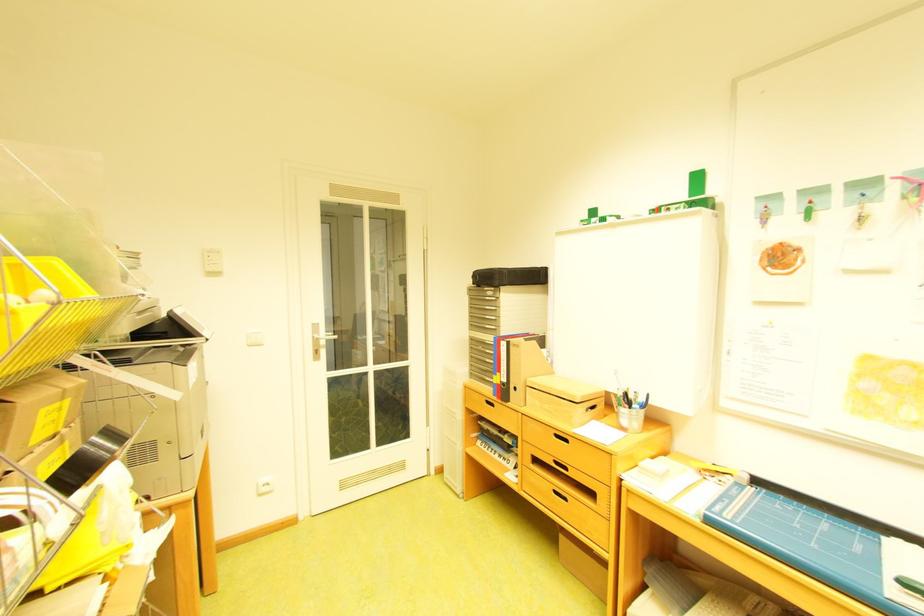
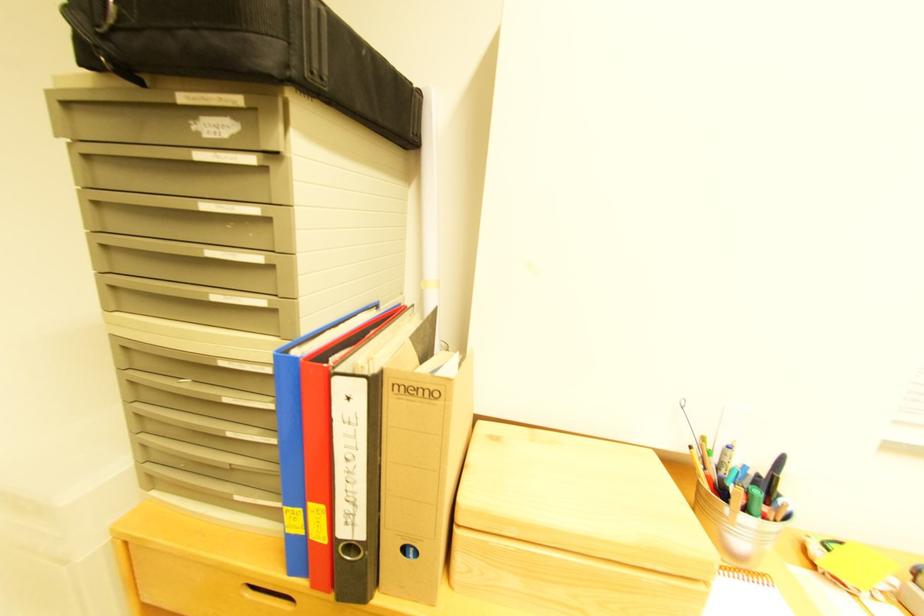
Where in the second image is the point corresponding to pixel 507 321 from the first image?

(282, 268)